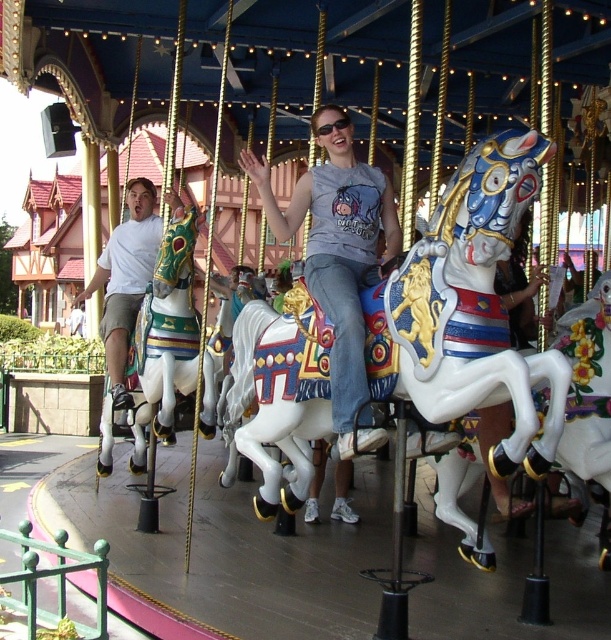
You are a photographer standing in front of the carousel. You want to take a photo of both the white glossy horse at center and the matte gray shirt at center. Which object should you focus on first if you want to capture them both clearly in the same frame?

The white glossy horse at center is shorter than the matte gray shirt at center, so you should focus on the matte gray shirt at center first to ensure both are in focus since it is closer to the camera.

You are standing in front of the carousel and want to determine which of the two points, point (177, 212) or point (133, 220), is closer to you. Based on the scene, which point is nearer?

Point (177, 212) is closer to the viewer than point (133, 220).